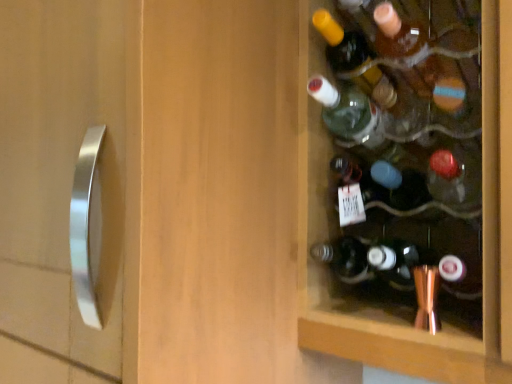
Image resolution: width=512 pixels, height=384 pixels. What do you see at coordinates (348, 114) in the screenshot?
I see `green glass bottle at upper right, the 2th bottle positioned from the bottom` at bounding box center [348, 114].

Find the location of `translucent glass bottle at center, which appears as the fourth bottle when viewed from the top`. translucent glass bottle at center, which appears as the fourth bottle when viewed from the top is located at coordinates (383, 182).

The height and width of the screenshot is (384, 512). Identify the location of translucent glass bottle at upper right, arranged as the 2th bottle when viewed from the top. (342, 44).

Identify the location of green glass bottle at upper right, acting as the third bottle starting from the top. [348, 114].

Is translucent amber glass bottle at upper right, the fourth bottle from the bottom, wider or thinner than translucent glass bottle at center, which appears as the fourth bottle when viewed from the top?

translucent amber glass bottle at upper right, the fourth bottle from the bottom, is thinner than translucent glass bottle at center, which appears as the fourth bottle when viewed from the top.

Is translucent amber glass bottle at upper right, the fourth bottle from the bottom, in contact with translucent glass bottle at center, placed as the 1th bottle when sorted from bottom to top?

They are not placed beside each other.

Based on the photo, between translucent amber glass bottle at upper right, the 1th bottle in the top-to-bottom sequence, and translucent glass bottle at center, placed as the 1th bottle when sorted from bottom to top, which one has more height?

translucent glass bottle at center, placed as the 1th bottle when sorted from bottom to top, is taller.

From the image's perspective, which is below, translucent glass bottle at upper right, arranged as the 2th bottle when viewed from the top, or green glass bottle at upper right, the 2th bottle positioned from the bottom?

green glass bottle at upper right, the 2th bottle positioned from the bottom, appears lower in the image.

Based on their sizes in the image, would you say translucent glass bottle at upper right, the third bottle ordered from the bottom, is bigger or smaller than green glass bottle at upper right, the 2th bottle positioned from the bottom?

Considering their sizes, translucent glass bottle at upper right, the third bottle ordered from the bottom, takes up less space than green glass bottle at upper right, the 2th bottle positioned from the bottom.

Between translucent glass bottle at upper right, the third bottle ordered from the bottom, and green glass bottle at upper right, acting as the third bottle starting from the top, which one has more height?

Standing taller between the two is green glass bottle at upper right, acting as the third bottle starting from the top.

Based on the photo, are green glass bottle at upper right, acting as the third bottle starting from the top, and translucent glass bottle at center, which appears as the fourth bottle when viewed from the top, beside each other?

Yes, green glass bottle at upper right, acting as the third bottle starting from the top, is beside translucent glass bottle at center, which appears as the fourth bottle when viewed from the top.

From the image's perspective, which is below, green glass bottle at upper right, the 2th bottle positioned from the bottom, or translucent glass bottle at center, placed as the 1th bottle when sorted from bottom to top?

From the image's view, translucent glass bottle at center, placed as the 1th bottle when sorted from bottom to top, is below.

Which bottle is the 2nd one when counting from the right side of the green glass bottle at upper right, the 2th bottle positioned from the bottom? Please provide its 2D coordinates.

[(383, 182)]

From a real-world perspective, which object rests below the other?

In real-world perspective, translucent glass bottle at center, placed as the 1th bottle when sorted from bottom to top, is lower.

Which object is thinner, translucent glass bottle at center, which appears as the fourth bottle when viewed from the top, or translucent amber glass bottle at upper right, the fourth bottle from the bottom?

translucent amber glass bottle at upper right, the fourth bottle from the bottom.

Is translucent glass bottle at center, which appears as the fourth bottle when viewed from the top, not close to translucent amber glass bottle at upper right, the 1th bottle in the top-to-bottom sequence?

No, translucent glass bottle at center, which appears as the fourth bottle when viewed from the top, is not far from translucent amber glass bottle at upper right, the 1th bottle in the top-to-bottom sequence.

Between translucent glass bottle at center, placed as the 1th bottle when sorted from bottom to top, and translucent amber glass bottle at upper right, the 1th bottle in the top-to-bottom sequence, which one appears on the right side from the viewer's perspective?

translucent amber glass bottle at upper right, the 1th bottle in the top-to-bottom sequence.

Who is more distant, green glass bottle at upper right, acting as the third bottle starting from the top, or translucent glass bottle at upper right, arranged as the 2th bottle when viewed from the top?

translucent glass bottle at upper right, arranged as the 2th bottle when viewed from the top, is more distant.

There is a translucent glass bottle at upper right, the third bottle ordered from the bottom. Identify the location of the 1st bottle below it (from the image's perspective). The height and width of the screenshot is (384, 512). (348, 114).

In the scene shown: Which of these two, green glass bottle at upper right, the 2th bottle positioned from the bottom, or translucent glass bottle at upper right, the third bottle ordered from the bottom, stands taller?

green glass bottle at upper right, the 2th bottle positioned from the bottom.

Which is more to the right, green glass bottle at upper right, acting as the third bottle starting from the top, or translucent glass bottle at upper right, the third bottle ordered from the bottom?

A: From the viewer's perspective, translucent glass bottle at upper right, the third bottle ordered from the bottom, appears more on the right side.

Considering the positions of objects green glass bottle at upper right, the 2th bottle positioned from the bottom, and translucent amber glass bottle at upper right, the fourth bottle from the bottom, in the image provided, who is more to the right, green glass bottle at upper right, the 2th bottle positioned from the bottom, or translucent amber glass bottle at upper right, the fourth bottle from the bottom,?

translucent amber glass bottle at upper right, the fourth bottle from the bottom.

Who is taller, green glass bottle at upper right, the 2th bottle positioned from the bottom, or translucent amber glass bottle at upper right, the 1th bottle in the top-to-bottom sequence?

green glass bottle at upper right, the 2th bottle positioned from the bottom, is taller.

How much distance is there between green glass bottle at upper right, the 2th bottle positioned from the bottom, and translucent amber glass bottle at upper right, the 1th bottle in the top-to-bottom sequence?

green glass bottle at upper right, the 2th bottle positioned from the bottom, is 6.41 inches away from translucent amber glass bottle at upper right, the 1th bottle in the top-to-bottom sequence.

Is green glass bottle at upper right, the 2th bottle positioned from the bottom, in front of or behind translucent amber glass bottle at upper right, the fourth bottle from the bottom, in the image?

Clearly, green glass bottle at upper right, the 2th bottle positioned from the bottom, is behind translucent amber glass bottle at upper right, the fourth bottle from the bottom.

The width and height of the screenshot is (512, 384). Find the location of `bottle that is the 1st one below the translucent amber glass bottle at upper right, the fourth bottle from the bottom (from a real-world perspective)`. bottle that is the 1st one below the translucent amber glass bottle at upper right, the fourth bottle from the bottom (from a real-world perspective) is located at coordinates (342, 44).

Does translucent glass bottle at upper right, arranged as the 2th bottle when viewed from the top, have a lesser height compared to translucent amber glass bottle at upper right, the fourth bottle from the bottom?

Yes.

Is translucent glass bottle at upper right, arranged as the 2th bottle when viewed from the top, directly adjacent to translucent amber glass bottle at upper right, the 1th bottle in the top-to-bottom sequence?

Yes, translucent glass bottle at upper right, arranged as the 2th bottle when viewed from the top, is touching translucent amber glass bottle at upper right, the 1th bottle in the top-to-bottom sequence.

Which object is positioned more to the left, translucent glass bottle at upper right, arranged as the 2th bottle when viewed from the top, or translucent amber glass bottle at upper right, the 1th bottle in the top-to-bottom sequence?

Positioned to the left is translucent glass bottle at upper right, arranged as the 2th bottle when viewed from the top.

From the image's perspective, starting from the translucent amber glass bottle at upper right, the fourth bottle from the bottom, which bottle is the 3rd one below? Please provide its 2D coordinates.

[(383, 182)]

Locate an element on the screen. This screenshot has height=384, width=512. bottle behind the green glass bottle at upper right, acting as the third bottle starting from the top is located at coordinates (342, 44).

When comparing their distances from green glass bottle at upper right, the 2th bottle positioned from the bottom, does translucent glass bottle at upper right, arranged as the 2th bottle when viewed from the top, or translucent amber glass bottle at upper right, the 1th bottle in the top-to-bottom sequence, seem further?

translucent amber glass bottle at upper right, the 1th bottle in the top-to-bottom sequence.

When comparing their distances from green glass bottle at upper right, the 2th bottle positioned from the bottom, does translucent glass bottle at center, placed as the 1th bottle when sorted from bottom to top, or translucent amber glass bottle at upper right, the 1th bottle in the top-to-bottom sequence, seem closer?

translucent glass bottle at center, placed as the 1th bottle when sorted from bottom to top, is closer to green glass bottle at upper right, the 2th bottle positioned from the bottom.

When comparing their distances from translucent glass bottle at center, which appears as the fourth bottle when viewed from the top, does green glass bottle at upper right, acting as the third bottle starting from the top, or translucent glass bottle at upper right, arranged as the 2th bottle when viewed from the top, seem further?

Based on the image, translucent glass bottle at upper right, arranged as the 2th bottle when viewed from the top, appears to be further to translucent glass bottle at center, which appears as the fourth bottle when viewed from the top.

Which object lies further to the anchor point translucent glass bottle at upper right, the third bottle ordered from the bottom, green glass bottle at upper right, acting as the third bottle starting from the top, or translucent amber glass bottle at upper right, the 1th bottle in the top-to-bottom sequence?

green glass bottle at upper right, acting as the third bottle starting from the top, is further to translucent glass bottle at upper right, the third bottle ordered from the bottom.

Based on their spatial positions, is translucent glass bottle at center, placed as the 1th bottle when sorted from bottom to top, or green glass bottle at upper right, acting as the third bottle starting from the top, closer to translucent glass bottle at upper right, the third bottle ordered from the bottom?

Among the two, green glass bottle at upper right, acting as the third bottle starting from the top, is located nearer to translucent glass bottle at upper right, the third bottle ordered from the bottom.

Looking at the image, which one is located further to translucent glass bottle at center, which appears as the fourth bottle when viewed from the top, translucent amber glass bottle at upper right, the 1th bottle in the top-to-bottom sequence, or green glass bottle at upper right, the 2th bottle positioned from the bottom?

Among the two, translucent amber glass bottle at upper right, the 1th bottle in the top-to-bottom sequence, is located further to translucent glass bottle at center, which appears as the fourth bottle when viewed from the top.

In the scene shown: From the image, which object appears to be nearer to translucent glass bottle at center, which appears as the fourth bottle when viewed from the top, translucent glass bottle at upper right, arranged as the 2th bottle when viewed from the top, or green glass bottle at upper right, acting as the third bottle starting from the top?

Among the two, green glass bottle at upper right, acting as the third bottle starting from the top, is located nearer to translucent glass bottle at center, which appears as the fourth bottle when viewed from the top.

Considering their positions, is translucent glass bottle at center, placed as the 1th bottle when sorted from bottom to top, positioned closer to translucent glass bottle at upper right, arranged as the 2th bottle when viewed from the top, than translucent amber glass bottle at upper right, the fourth bottle from the bottom?

translucent amber glass bottle at upper right, the fourth bottle from the bottom.

You are a GUI agent. You are given a task and a screenshot of the screen. Output one action in this format:
    pyautogui.click(x=<x>, y=<y>)
    Task: Click on the bottle between translucent glass bottle at upper right, the third bottle ordered from the bottom, and translucent glass bottle at center, which appears as the fourth bottle when viewed from the top, in the up-down direction
    Image resolution: width=512 pixels, height=384 pixels.
    Given the screenshot: What is the action you would take?
    pyautogui.click(x=348, y=114)

Locate an element on the screen. bottle between translucent amber glass bottle at upper right, the 1th bottle in the top-to-bottom sequence, and green glass bottle at upper right, the 2th bottle positioned from the bottom, in the vertical direction is located at coordinates (342, 44).